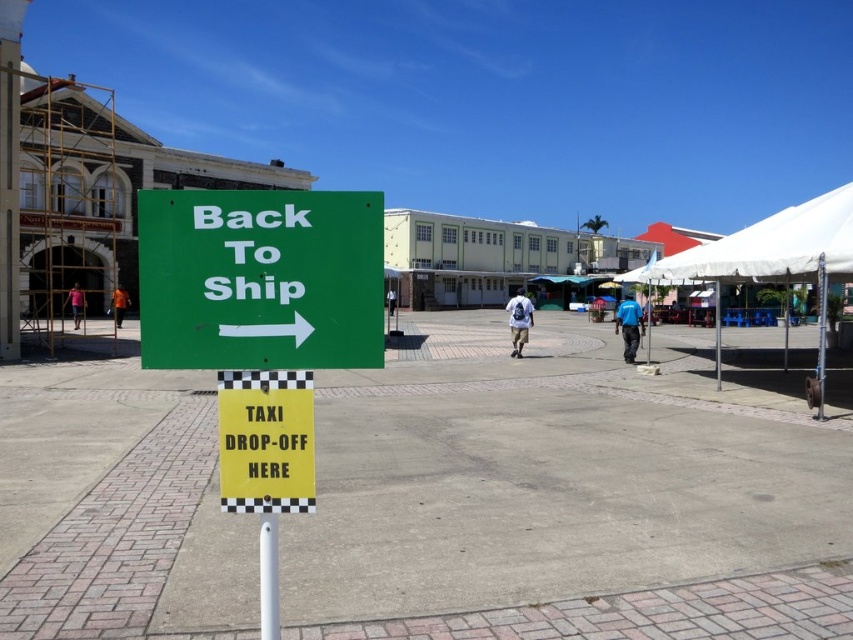
You are a tourist trying to find shade while waiting for a taxi at the plaza. You see a white fabric canopy at upper right and a white plastic pole at center. Which object is closer to you, and would it provide shade?

The white fabric canopy at upper right is closer to you than the white plastic pole at center. Since it is a canopy, it likely provides shade, while the pole may not.

You are a tourist holding a map and looking at the signs. You notice a metallic pole at center and an orange shirt at left. Which object is bigger in size?

The metallic pole at center is larger in size compared to the orange shirt at left.